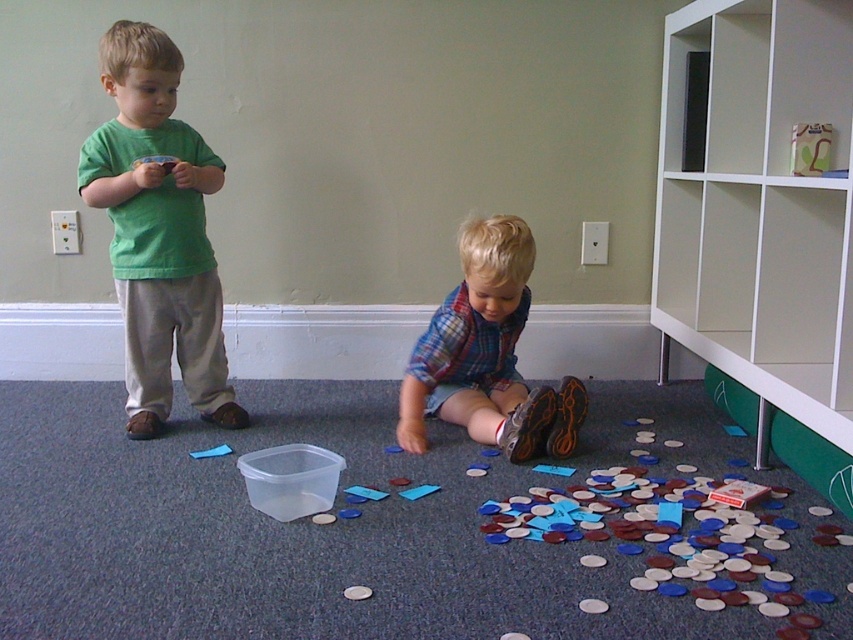
You are a photographer setting up a shot of the two children in the room. You want to ensure the green matte shirt at left is in focus. Where should you position your camera relative to the point marked at coordinates (158, 232)?

The point at coordinates (158, 232) marks the location of the green matte shirt at left, so positioning the camera directly at that point will ensure it is in focus.

You are a parent trying to determine which child is closer to you based on their clothing. You see the green matte shirt at left and the plaid fabric shirt at lower center. Which child is closer to your position?

The green matte shirt at left is positioned over the plaid fabric shirt at lower center, meaning it is closer to you.

You are a photographer trying to capture both the green matte shirt at left and the plaid fabric shirt at lower center in a single shot. Which child should you adjust your camera focus to prioritize to ensure both are in frame?

You should prioritize focusing on the green matte shirt at left first since it is closer to the viewer than the plaid fabric shirt at lower center, ensuring both are within the camera frame.